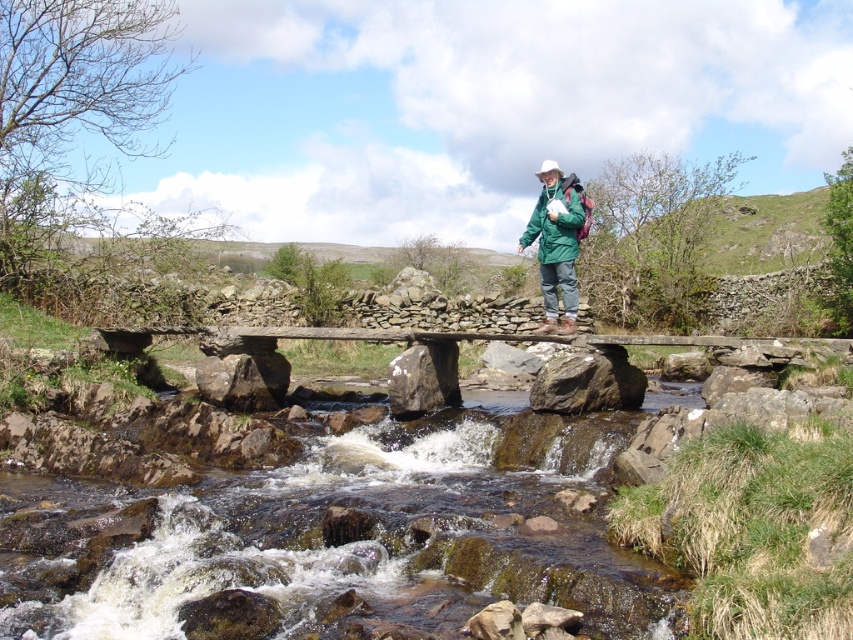
Is rocky brown river at center positioned before green matte jacket at upper center?

That is True.

Which is in front, point (320, 625) or point (543, 244)?

Point (320, 625) is in front.

Who is more distant from viewer, (506,532) or (550,218)?

The point (550,218) is behind.

This screenshot has height=640, width=853. In order to click on rocky brown river at center in this screenshot , I will do `click(328, 541)`.

Between point (120, 348) and point (578, 202), which one is positioned in front?

Point (578, 202) is in front.

Who is higher up, stone bridge at center or green matte jacket at upper center?

Positioned higher is green matte jacket at upper center.

Which is in front, point (250, 332) or point (556, 250)?

Point (556, 250) is more forward.

What are the coordinates of `stone bridge at center` in the screenshot? It's located at (401, 336).

Is green fabric jacket at center to the right of green matte jacket at upper center from the viewer's perspective?

Correct, you'll find green fabric jacket at center to the right of green matte jacket at upper center.

Who is more distant from viewer, (572, 241) or (566, 246)?

The point (572, 241) is behind.

Identify the location of green fabric jacket at center. This screenshot has width=853, height=640. (555, 244).